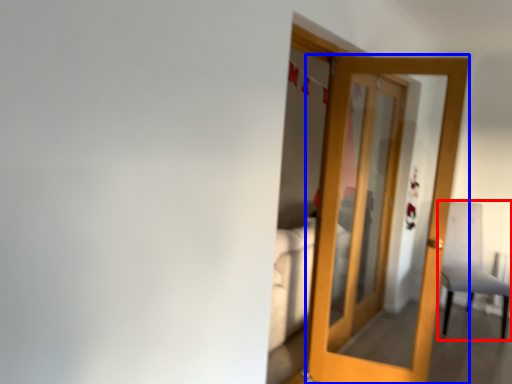
Question: Which of the following is the farthest to the observer, chair (highlighted by a red box) or door (highlighted by a blue box)?

Choices:
 (A) chair
 (B) door

Answer: (A)